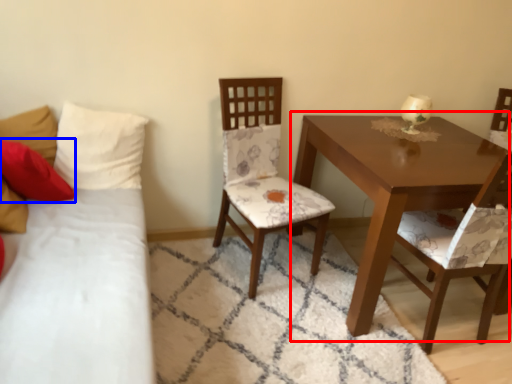
Question: Which of the following is the farthest to the observer, table (highlighted by a red box) or pillow (highlighted by a blue box)?

Choices:
 (A) table
 (B) pillow

Answer: (B)